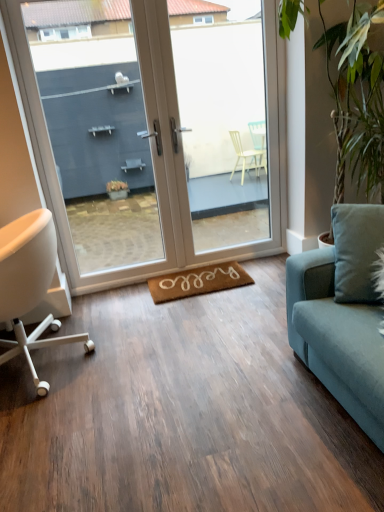
Where is `vacant region below white matte chair at left (from a real-world perspective)`? Image resolution: width=384 pixels, height=512 pixels. vacant region below white matte chair at left (from a real-world perspective) is located at coordinates (57, 358).